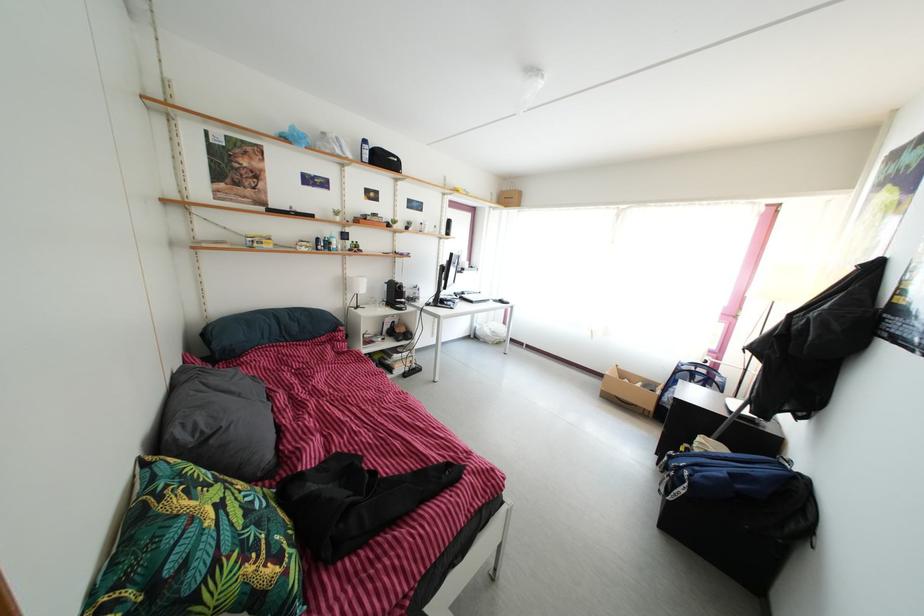
The location [400,331] corresponds to which object?

This point indicates the black headphones.